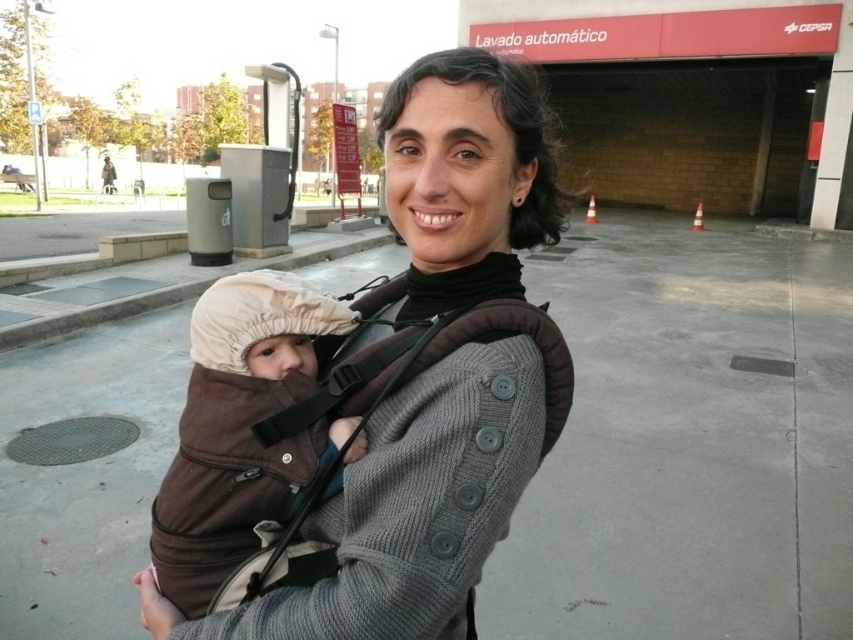
Which is more to the left, knit gray sweater at center or brown fleece baby at center?

From the viewer's perspective, brown fleece baby at center appears more on the left side.

Does point (451, 108) come farther from viewer compared to point (218, 472)?

No, it is not.

Where is `knit gray sweater at center`? knit gray sweater at center is located at coordinates (415, 497).